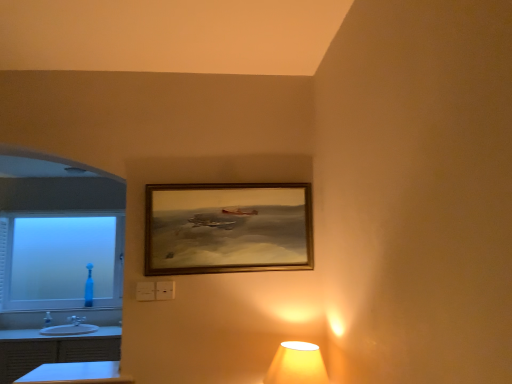
Identify the location of white glossy sink at lower left. (70, 328).

Locate an element on the screen. The width and height of the screenshot is (512, 384). brushed metal faucet at lower left is located at coordinates (76, 320).

What is the approximate height of matte yellow lampshade at lower right?

matte yellow lampshade at lower right is 8.87 inches tall.

Measure the distance between blue glass bottle at lower left and camera.

blue glass bottle at lower left is 4.51 meters from camera.

What do you see at coordinates (227, 228) in the screenshot? The height and width of the screenshot is (384, 512). I see `wooden frame at center` at bounding box center [227, 228].

At what (x,y) coordinates should I click in order to perform the action: click on blue glossy table at lower left. Please return your answer as a coordinate pair (x, y). The height and width of the screenshot is (384, 512). Looking at the image, I should click on (76, 374).

Is the depth of blue glossy table at lower left greater than that of wooden frame at center?

No, blue glossy table at lower left is closer to the viewer.

Is blue glossy table at lower left facing towards wooden frame at center?

No, blue glossy table at lower left is not facing towards wooden frame at center.

Which is more to the left, blue glossy table at lower left or wooden frame at center?

blue glossy table at lower left is more to the left.

Is blue glossy table at lower left outside of wooden frame at center?

blue glossy table at lower left is positioned outside wooden frame at center.

Is brushed metal faucet at lower left spatially inside wooden frame at center, or outside of it?

brushed metal faucet at lower left is outside wooden frame at center.

From a real-world perspective, between brushed metal faucet at lower left and wooden frame at center, who is vertically lower?

In real-world perspective, brushed metal faucet at lower left is lower.

From the picture: Looking at the image, does brushed metal faucet at lower left seem bigger or smaller compared to wooden frame at center?

brushed metal faucet at lower left is smaller than wooden frame at center.

Between point (73, 317) and point (155, 265), which one is positioned behind?

Positioned behind is point (73, 317).

Is brushed metal faucet at lower left facing towards matte yellow lampshade at lower right?

No, brushed metal faucet at lower left is not facing towards matte yellow lampshade at lower right.

Between brushed metal faucet at lower left and matte yellow lampshade at lower right, which one has less height?

With less height is brushed metal faucet at lower left.

In the scene shown: From the image's perspective, is brushed metal faucet at lower left located above or below matte yellow lampshade at lower right?

brushed metal faucet at lower left is situated lower than matte yellow lampshade at lower right in the image.

Identify the location of tap below the matte yellow lampshade at lower right (from the image's perspective). This screenshot has width=512, height=384. (76, 320).

How many degrees apart are the facing directions of white glossy sink at lower left and wooden frame at center?

The facing directions of white glossy sink at lower left and wooden frame at center are 0.000349 degrees apart.

Considering the sizes of objects white glossy sink at lower left and wooden frame at center in the image provided, who is thinner, white glossy sink at lower left or wooden frame at center?

wooden frame at center is thinner.

From a real-world perspective, who is located lower, white glossy sink at lower left or wooden frame at center?

In real-world perspective, white glossy sink at lower left is lower.

Identify the location of picture frame on the right of the white glossy sink at lower left. The height and width of the screenshot is (384, 512). (227, 228).

Is white glossy dresser at lower left not inside matte yellow lampshade at lower right?

Yes, white glossy dresser at lower left is located beyond the bounds of matte yellow lampshade at lower right.

In terms of height, does white glossy dresser at lower left look taller or shorter compared to matte yellow lampshade at lower right?

In the image, white glossy dresser at lower left appears to be taller than matte yellow lampshade at lower right.

From the image's perspective, is white glossy dresser at lower left above matte yellow lampshade at lower right?

Incorrect, from the image's perspective, white glossy dresser at lower left is lower than matte yellow lampshade at lower right.

Is white glossy dresser at lower left to the left of matte yellow lampshade at lower right from the viewer's perspective?

Indeed, white glossy dresser at lower left is positioned on the left side of matte yellow lampshade at lower right.

What's the angular difference between brushed metal faucet at lower left and white glossy sink at lower left's facing directions?

They differ by 0.882 degrees in their facing directions.

Is brushed metal faucet at lower left with white glossy sink at lower left?

No, brushed metal faucet at lower left is not making contact with white glossy sink at lower left.

Is brushed metal faucet at lower left wider than white glossy sink at lower left?

Incorrect, the width of brushed metal faucet at lower left does not surpass that of white glossy sink at lower left.

In the image, is brushed metal faucet at lower left on the left side or the right side of white glossy sink at lower left?

brushed metal faucet at lower left is positioned on white glossy sink at lower left's left side.

Looking at this image, is blue glossy table at lower left taller or shorter than frosted glass window at left?

Clearly, blue glossy table at lower left is shorter compared to frosted glass window at left.

How different are the orientations of blue glossy table at lower left and frosted glass window at left in degrees?

90 degrees separate the facing orientations of blue glossy table at lower left and frosted glass window at left.

Measure the distance from blue glossy table at lower left to frosted glass window at left.

blue glossy table at lower left and frosted glass window at left are 3.51 meters apart from each other.

Does blue glossy table at lower left lie in front of frosted glass window at left?

Yes, it is in front of frosted glass window at left.

The width and height of the screenshot is (512, 384). What are the coordinates of `table lying on the left of wooden frame at center` in the screenshot? It's located at (76, 374).

You are a GUI agent. You are given a task and a screenshot of the screen. Output one action in this format:
    pyautogui.click(x=<x>, y=<y>)
    Task: Click on the picture frame located above the brushed metal faucet at lower left (from the image's perspective)
    The width and height of the screenshot is (512, 384).
    Given the screenshot: What is the action you would take?
    pyautogui.click(x=227, y=228)

Based on their spatial positions, is blue glass bottle at lower left or wooden frame at center further from frosted glass window at left?

wooden frame at center.

Which object lies further to the anchor point blue glass bottle at lower left, blue glossy table at lower left or white glossy dresser at lower left?

blue glossy table at lower left.

Looking at the image, which one is located closer to blue glass bottle at lower left, frosted glass window at left or wooden frame at center?

frosted glass window at left is closer to blue glass bottle at lower left.

When comparing their distances from frosted glass window at left, does wooden frame at center or white glossy dresser at lower left seem closer?

The object closer to frosted glass window at left is white glossy dresser at lower left.

Based on their spatial positions, is matte yellow lampshade at lower right or white glossy dresser at lower left further from wooden frame at center?

white glossy dresser at lower left is further to wooden frame at center.

From the image, which object appears to be farther from matte yellow lampshade at lower right, blue glass bottle at lower left or white glossy dresser at lower left?

Based on the image, blue glass bottle at lower left appears to be further to matte yellow lampshade at lower right.

Which object lies further to the anchor point white glossy dresser at lower left, matte yellow lampshade at lower right or blue glass bottle at lower left?

Among the two, matte yellow lampshade at lower right is located further to white glossy dresser at lower left.

Considering their positions, is blue glass bottle at lower left positioned closer to wooden frame at center than frosted glass window at left?

Based on the image, blue glass bottle at lower left appears to be nearer to wooden frame at center.

Where is `sink located between wooden frame at center and brushed metal faucet at lower left in the depth direction`? sink located between wooden frame at center and brushed metal faucet at lower left in the depth direction is located at coordinates (70, 328).

Find the location of a particular element. dresser between matte yellow lampshade at lower right and frosted glass window at left along the z-axis is located at coordinates pos(53,350).

Identify the location of tap located between blue glossy table at lower left and blue glass bottle at lower left in the depth direction. The height and width of the screenshot is (384, 512). (76, 320).

Where is `table between matte yellow lampshade at lower right and blue glass bottle at lower left along the z-axis`? Image resolution: width=512 pixels, height=384 pixels. table between matte yellow lampshade at lower right and blue glass bottle at lower left along the z-axis is located at coordinates (76, 374).